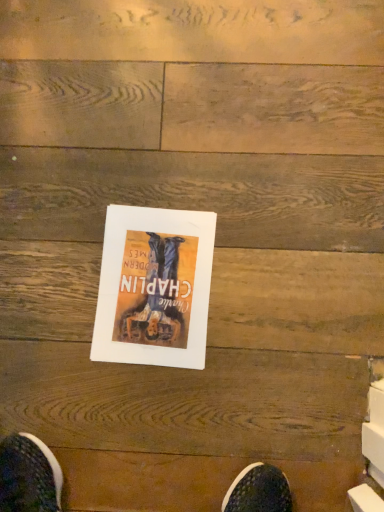
You are a GUI agent. You are given a task and a screenshot of the screen. Output one action in this format:
    pyautogui.click(x=<x>, y=<y>)
    Task: Click on the blank space situated above white paper at center (from a real-world perspective)
    
    Given the screenshot: What is the action you would take?
    [142, 282]